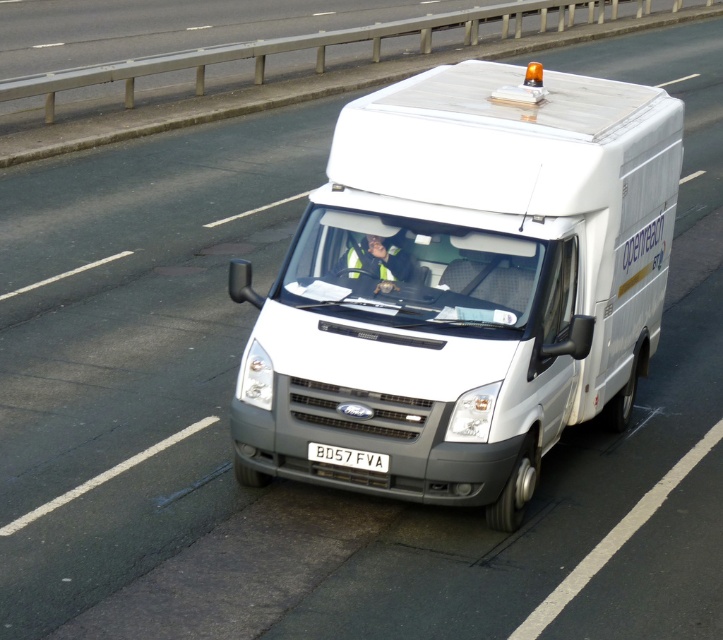
Question: From the image, what is the correct spatial relationship of white matte van at center in relation to white plastic license plate at center?

Choices:
 (A) right
 (B) left

Answer: (A)

Question: In this image, where is white matte van at center located relative to white plastic license plate at center?

Choices:
 (A) below
 (B) above

Answer: (B)

Question: Which point is closer to the camera taking this photo?

Choices:
 (A) (325, 445)
 (B) (427, 93)

Answer: (A)

Question: Is white matte van at center below white plastic license plate at center?

Choices:
 (A) no
 (B) yes

Answer: (A)